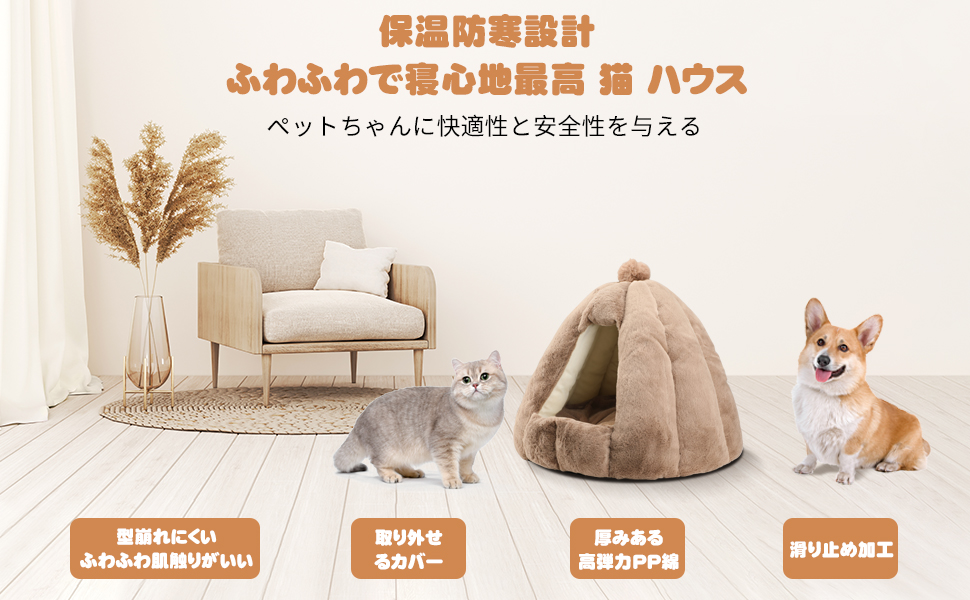
Identify the location of curtain. (43, 243).